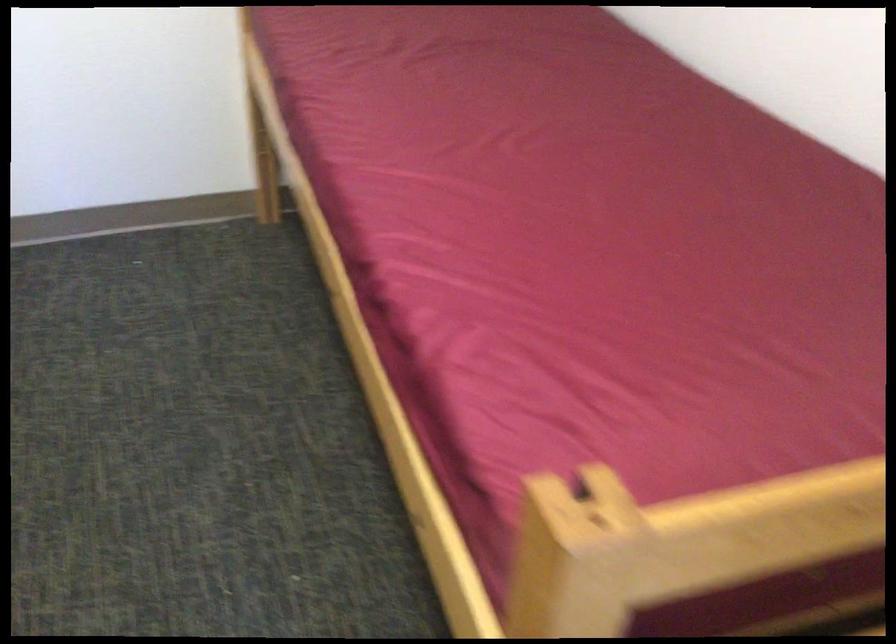
The image size is (896, 644). I want to click on bed frame handle, so click(x=684, y=536).